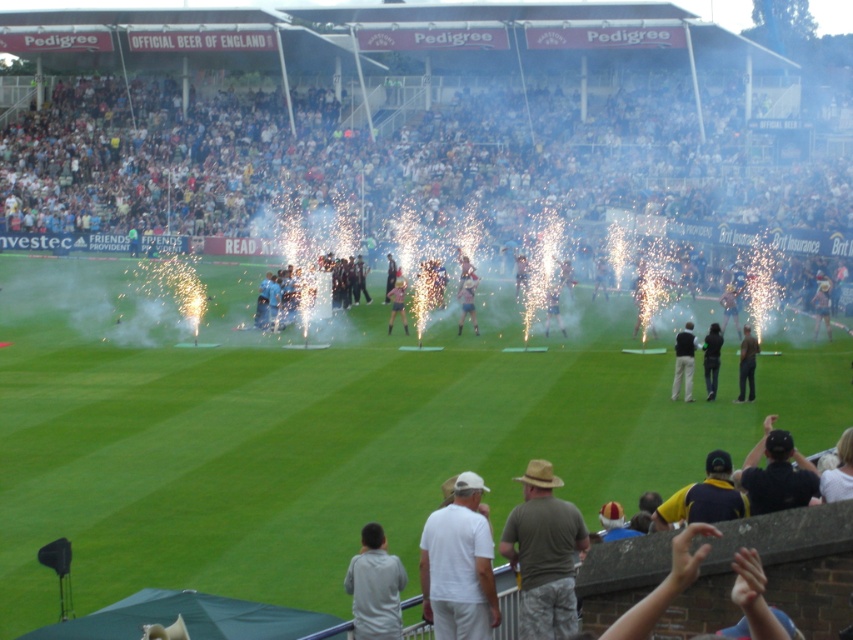
Question: Which point is farther to the camera?

Choices:
 (A) (550, 292)
 (B) (718, 346)
 (C) (828, 330)
 (D) (471, 627)

Answer: (A)

Question: Which object is farther from the camera taking this photo?

Choices:
 (A) dark green fabric at center
 (B) black fabric jacket at center
 (C) light brown straw hat at lower center
 (D) white cotton crowd at upper center

Answer: (D)

Question: Is light blue fabric at center to the right of light brown fabric pants at center from the viewer's perspective?

Choices:
 (A) yes
 (B) no

Answer: (A)

Question: In this image, where is dark gray shirt at center located relative to dark green fabric at center?

Choices:
 (A) below
 (B) above

Answer: (A)

Question: Which of the following is the closest to the observer?

Choices:
 (A) camouflage shorts at center
 (B) black fabric cap at lower right

Answer: (A)

Question: Can you confirm if black fabric jacket at center is thinner than light blue jersey at center?

Choices:
 (A) yes
 (B) no

Answer: (B)